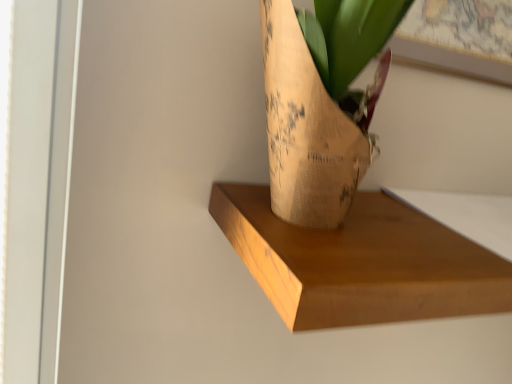
Find the location of a particular element. This screenshot has height=384, width=512. blank space situated above wooden shelf at center (from a real-world perspective) is located at coordinates (426, 220).